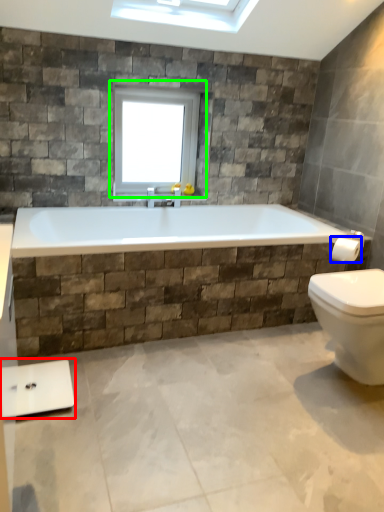
Question: Which object is the closest to the scale (highlighted by a red box)? Choose among these: towel bar (highlighted by a blue box) or window (highlighted by a green box).

Choices:
 (A) towel bar
 (B) window

Answer: (B)